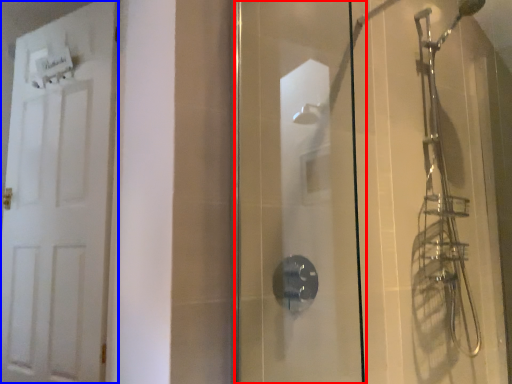
Question: Which point is further to the camera, screen door (highlighted by a red box) or door (highlighted by a blue box)?

Choices:
 (A) screen door
 (B) door

Answer: (B)